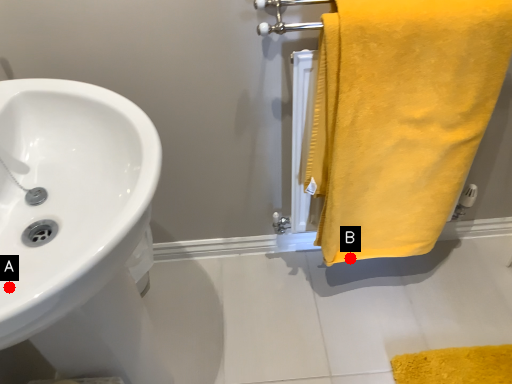
Question: Two points are circled on the image, labeled by A and B beside each circle. Which point is closer to the camera?

Choices:
 (A) A is closer
 (B) B is closer

Answer: (A)